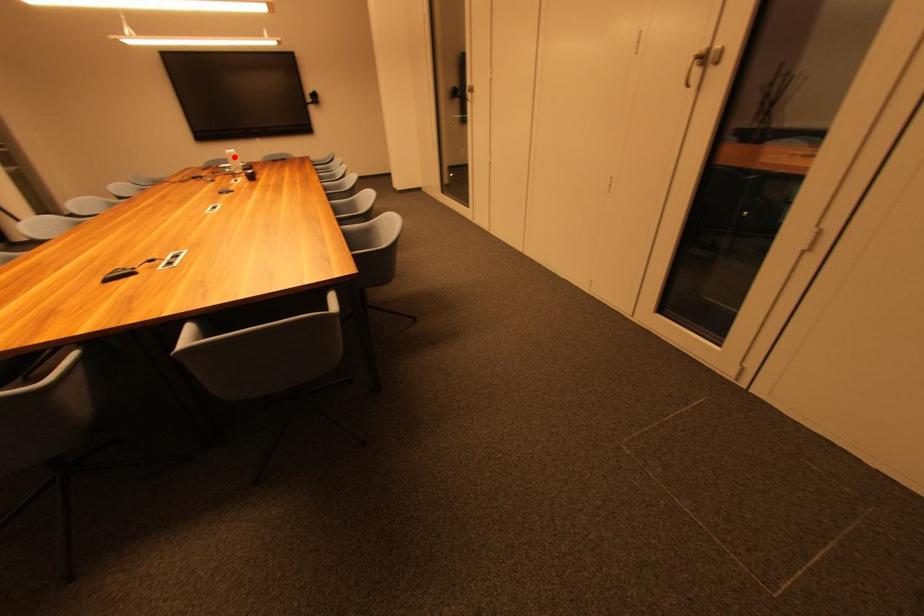
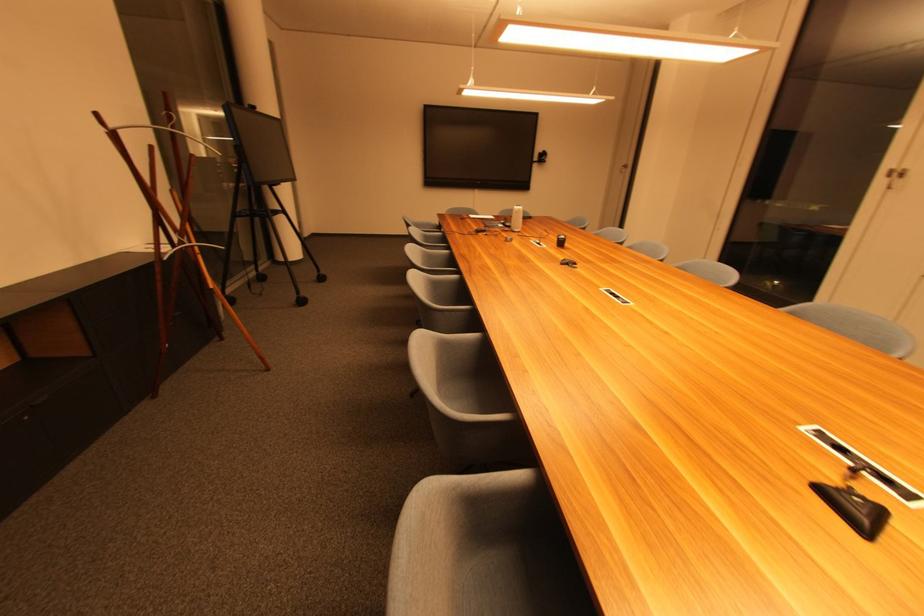
Question: I am providing you with two images of the same scene from different viewpoints. Given a red point in image1, look at the same physical point in image2. Is it:

Choices:
 (A) Closer to the viewpoint
 (B) Farther from the viewpoint

Answer: (A)